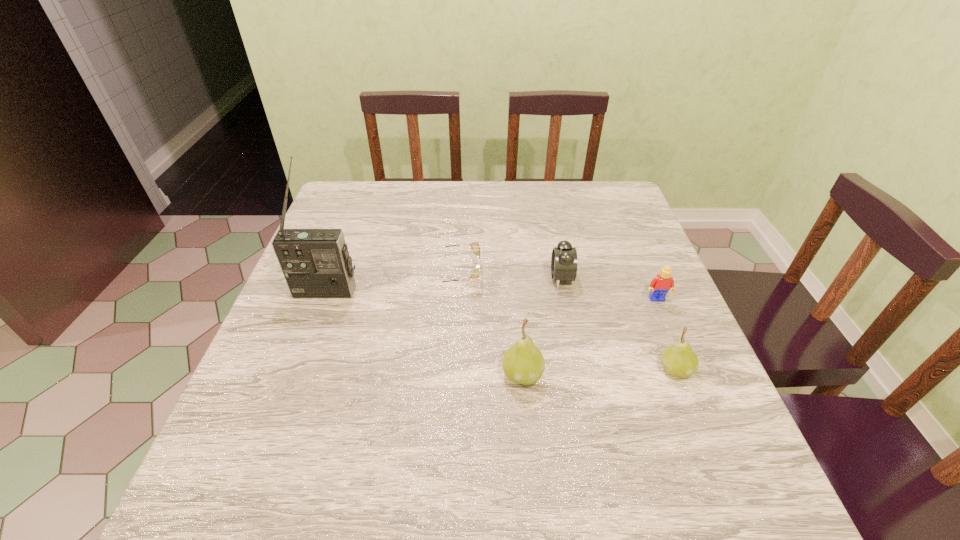
Image resolution: width=960 pixels, height=540 pixels. I want to click on the taller pear, so click(x=523, y=363).

I want to click on the second tallest object, so click(523, 363).

Find the location of a particular element. The width and height of the screenshot is (960, 540). the shorter pear is located at coordinates (679, 360).

Find the location of a particular element. Image resolution: width=960 pixels, height=540 pixels. the shortest object is located at coordinates (475, 246).

Identify the location of sunglasses. (475, 246).

Where is `Lego`? Lego is located at coordinates (663, 282).

Locate an element on the screen. The height and width of the screenshot is (540, 960). the fourth object from left to right is located at coordinates (564, 258).

This screenshot has height=540, width=960. Find the location of `radio receiver`. radio receiver is located at coordinates (316, 264).

The height and width of the screenshot is (540, 960). I want to click on the leftmost object, so click(316, 264).

Identify the location of vacant space located 0.060m on the front of the third object from left to right. (527, 421).